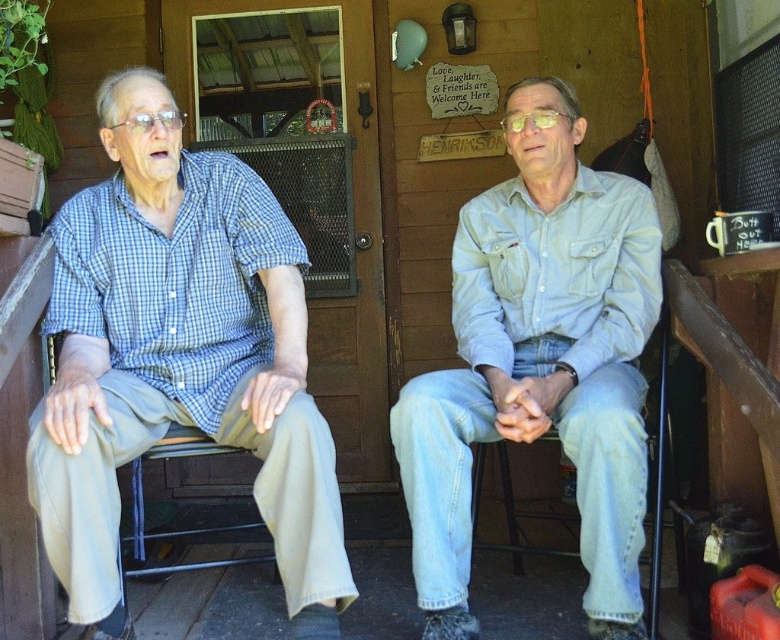
You are a photographer wanting to capture a closeup of both the matte blue plaid shirt at left and the light blue denim jeans at center. Since you can only focus on one object at a time, which one should you choose to ensure the other remains in the background?

The matte blue plaid shirt at left is positioned on the left side of light blue denim jeans at center, so focusing on the matte blue plaid shirt at left would place the light blue denim jeans at center in the background.

You are a photographer trying to capture a candid shot of the two men on the porch. You want to ensure that the matte blue plaid shirt at left and the denim jeans at center are both in the frame. Based on their positions, which object should you focus on first to include both in the shot?

The matte blue plaid shirt at left is positioned on the left side of denim jeans at center. To include both in the shot, you should focus on the denim jeans at center first as it is centrally located, ensuring the matte blue plaid shirt at left is also captured to the left of it.